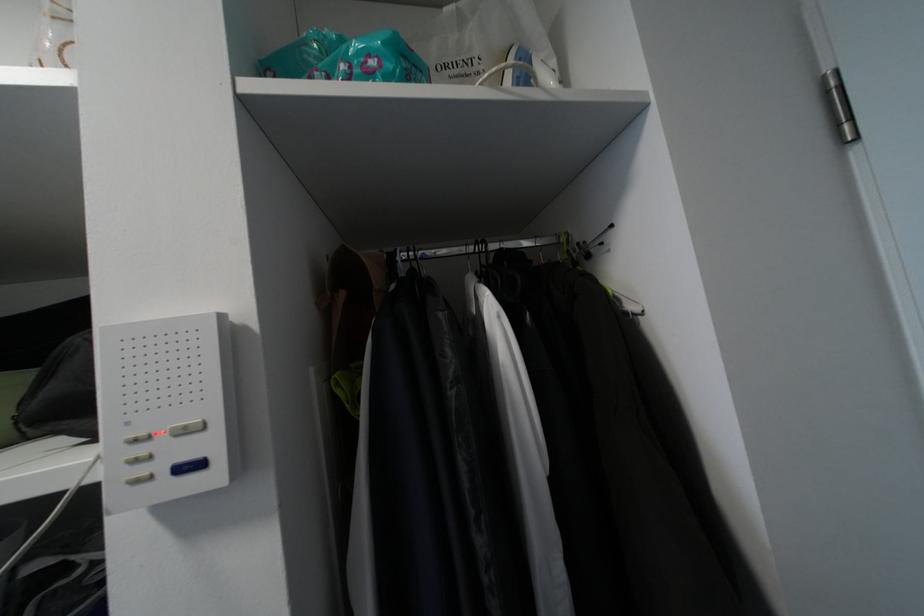
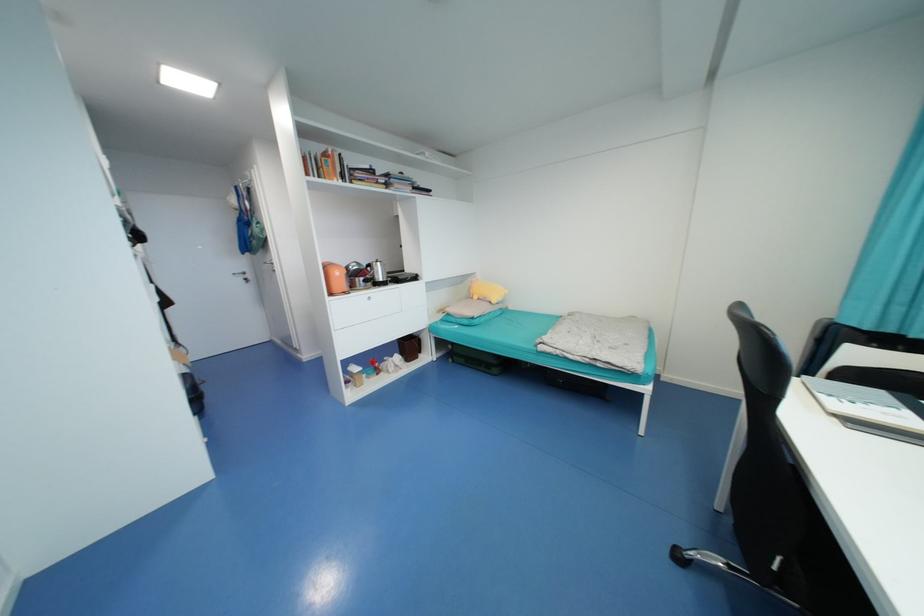
Question: I am providing you with two images of the same scene from different viewpoints. Which of the following objects are not visible in image2?

Choices:
 (A) book
 (B) yellow stuffed toy
 (C) black flip-flop
 (D) black hanger hook

Answer: (D)